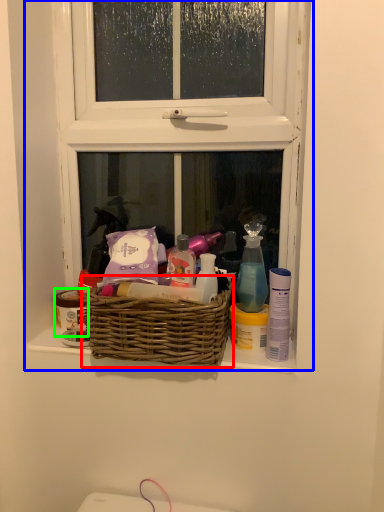
Question: Which is nearer to the picnic basket (highlighted by a red box)? window (highlighted by a blue box) or toiletry (highlighted by a green box).

Choices:
 (A) window
 (B) toiletry

Answer: (B)